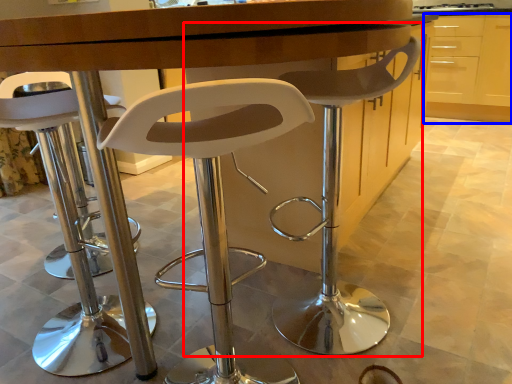
Question: Which point is closer to the camera, chair (highlighted by a red box) or cabinetry (highlighted by a blue box)?

Choices:
 (A) chair
 (B) cabinetry

Answer: (A)